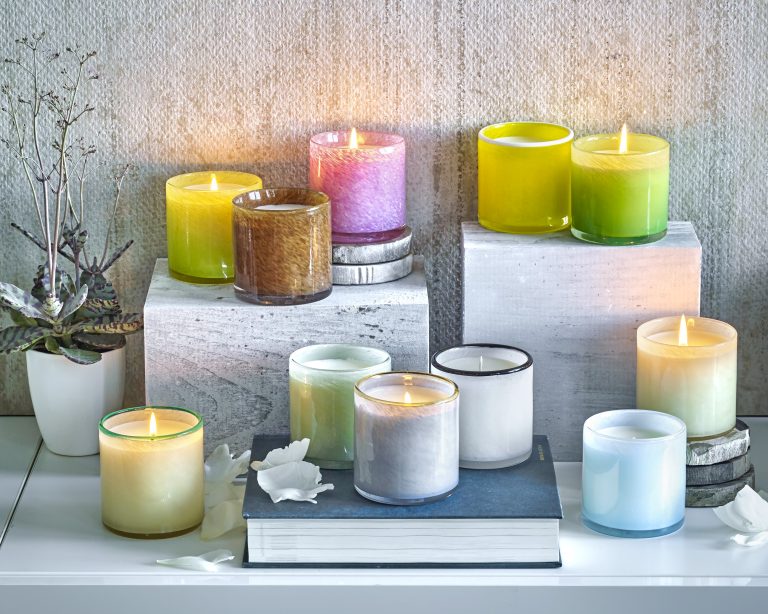
Where is `lit candles`? This screenshot has width=768, height=614. lit candles is located at coordinates (153, 437), (405, 406), (683, 351), (618, 160), (353, 153), (209, 199).